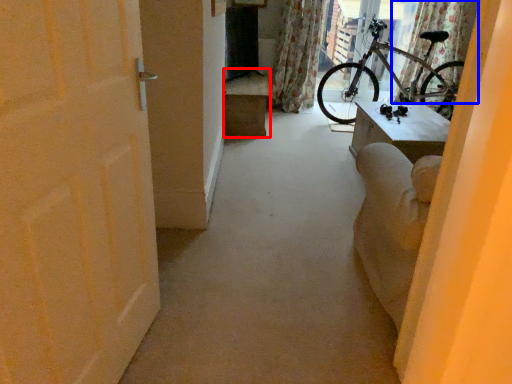
Question: Which point is further to the camera, furniture (highlighted by a red box) or curtain (highlighted by a blue box)?

Choices:
 (A) furniture
 (B) curtain

Answer: (B)